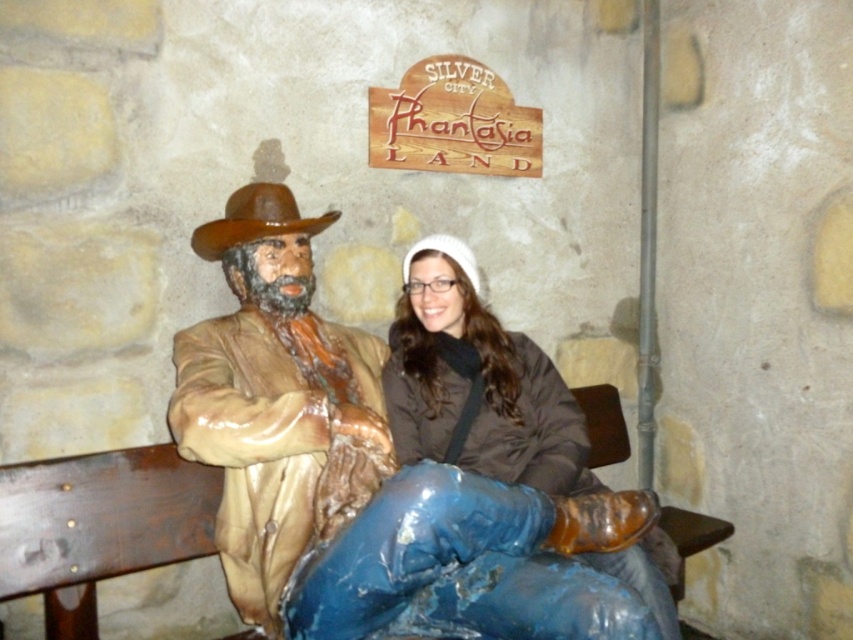
You are standing in front of a rustic stone wall scene. You see a matte brown statue at left and a matte brown jacket at center. Which object is positioned to the right of the other?

The matte brown jacket at center is to the right of the matte brown statue at left.

You are a photographer standing at the camera position. You want to take a photo of the matte brown statue at left and ensure it fills the frame without cropping. Your camera has a focal length of 50mm. Knowing that the statue is 1.94 meters away from you, what is the minimum sensor width your camera needs to have to capture the statue fully? Assume the statue is 1.8 meters tall and the camera sensor aspect ratio is 3x2.

The statue is 1.8 meters tall and 1.94 meters away from the camera. To calculate the required sensor width, use the formula sensor width needed equals object height multiplied by focal length divided by distance. So, 1.8 meters multiplied by 50mm divided by 1.94 meters equals approximately 46.39 mm. Since the sensor aspect ratio is 3x2, the minimum sensor width required is 46.4 mm to fully capture the matte brown statue at left without cropping.